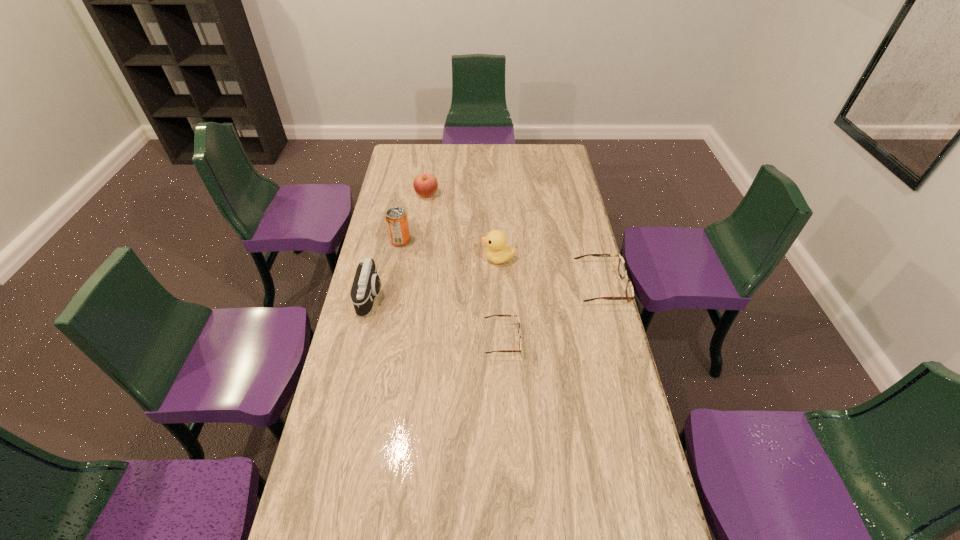
Locate an element on the screen. free space located on the front of the third shortest object is located at coordinates (420, 245).

Locate an element on the screen. vacant space located on the back of the soda can is located at coordinates (408, 201).

You are a GUI agent. You are given a task and a screenshot of the screen. Output one action in this format:
    pyautogui.click(x=<x>, y=<y>)
    Task: Click on the free space located 0.050m on the front lens of the camera
    The width and height of the screenshot is (960, 540).
    Given the screenshot: What is the action you would take?
    pyautogui.click(x=396, y=296)

Where is `free region located on the face of the duck`? This screenshot has width=960, height=540. free region located on the face of the duck is located at coordinates (417, 258).

The height and width of the screenshot is (540, 960). I want to click on vacant space situated on the face of the duck, so click(x=426, y=258).

The width and height of the screenshot is (960, 540). Identify the location of vacant area situated 0.360m on the face of the duck. (392, 258).

Locate an element on the screen. This screenshot has height=540, width=960. apple located at the left edge is located at coordinates (425, 185).

Identify the location of soda can located in the left edge section of the desktop. This screenshot has width=960, height=540. (397, 223).

Where is `camera located in the left edge section of the desktop`? The height and width of the screenshot is (540, 960). camera located in the left edge section of the desktop is located at coordinates (366, 285).

This screenshot has height=540, width=960. I want to click on object located at the right edge, so click(622, 270).